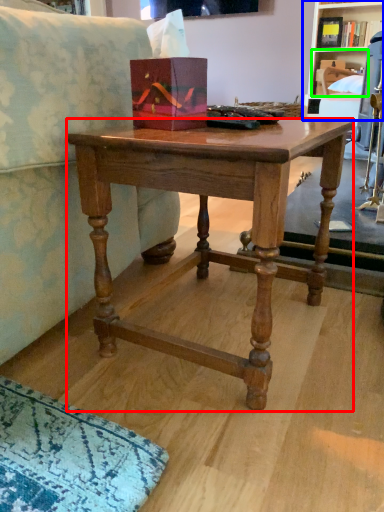
Question: Based on their relative distances, which object is nearer to desk (highlighted by a red box)? Choose from shelf (highlighted by a blue box) and shelf (highlighted by a green box).

Choices:
 (A) shelf
 (B) shelf

Answer: (A)